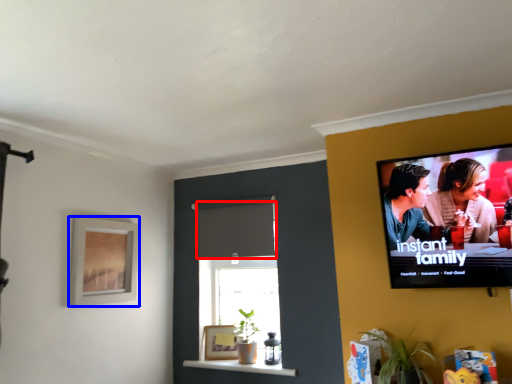
Question: Which of the following is the farthest to the observer, curtain (highlighted by a red box) or picture frame (highlighted by a blue box)?

Choices:
 (A) curtain
 (B) picture frame

Answer: (A)